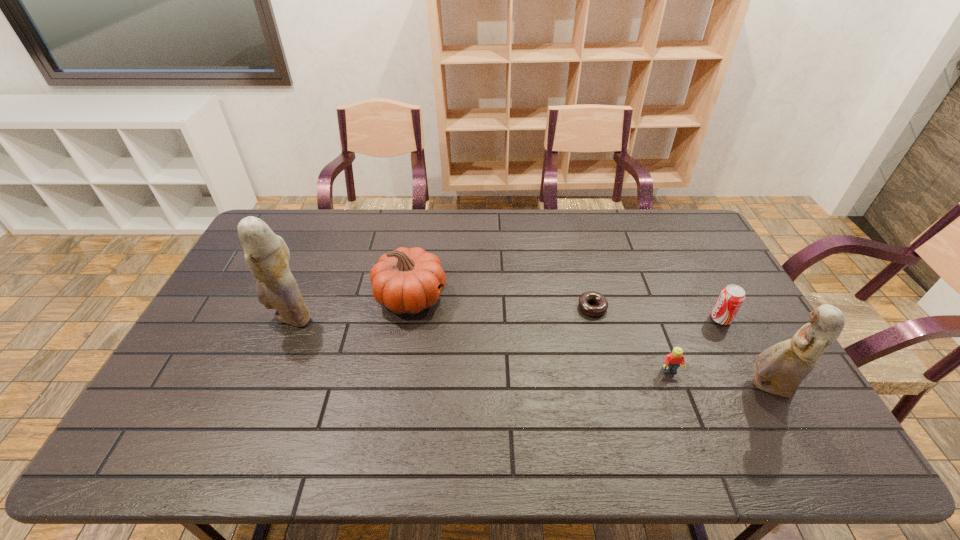
Find the location of a particular element. Image resolution: width=960 pixels, height=540 pixels. vacant spot for a new figurine to ensure equal spacing is located at coordinates (512, 349).